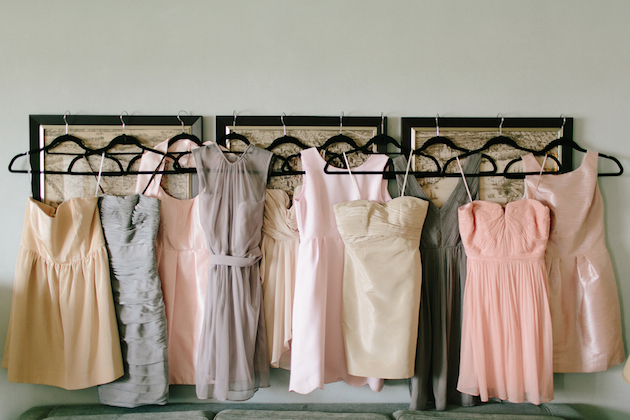
At what (x,y) coordinates should I click in order to perform the action: click on metal hooks on hangers. Please return your answer as a coordinate pair (x, y). Image resolution: width=630 pixels, height=420 pixels. Looking at the image, I should click on (66, 115), (118, 115), (176, 114), (231, 117), (282, 114), (343, 114), (387, 118), (435, 118), (501, 123), (559, 114).